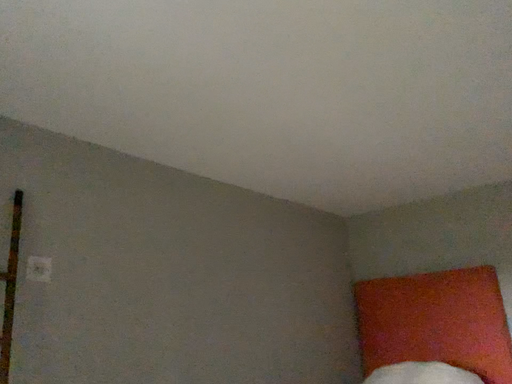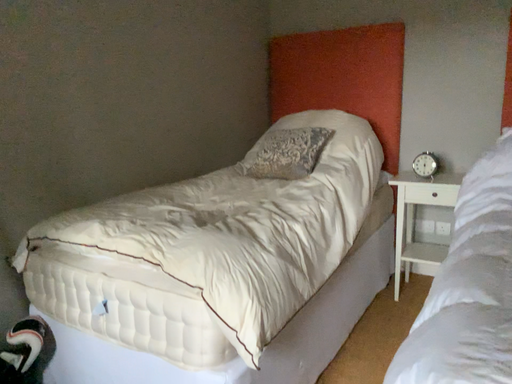
Question: Which way did the camera rotate in the video?

Choices:
 (A) rotated left
 (B) rotated right

Answer: (B)